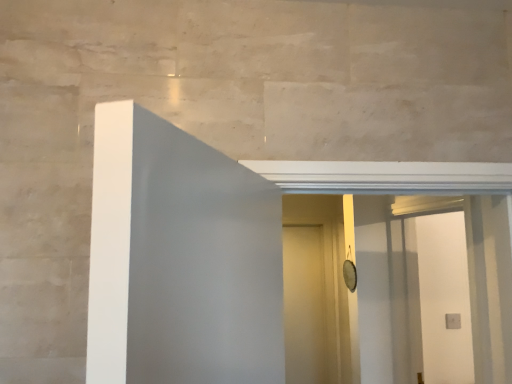
Question: Is white matte door at center completely or partially inside white glossy screen door at center?

Choices:
 (A) yes
 (B) no

Answer: (B)

Question: Is the surface of white glossy screen door at center in direct contact with white matte door at center?

Choices:
 (A) yes
 (B) no

Answer: (B)

Question: Considering the relative sizes of white glossy screen door at center and white matte door at center in the image provided, is white glossy screen door at center taller than white matte door at center?

Choices:
 (A) yes
 (B) no

Answer: (B)

Question: Is white glossy screen door at center positioned in front of white matte door at center?

Choices:
 (A) no
 (B) yes

Answer: (B)

Question: Is white glossy screen door at center looking in the opposite direction of white matte door at center?

Choices:
 (A) yes
 (B) no

Answer: (B)

Question: Could you tell me if white glossy screen door at center is facing white matte door at center?

Choices:
 (A) yes
 (B) no

Answer: (B)

Question: Is white matte door at center facing towards white glossy screen door at center?

Choices:
 (A) no
 (B) yes

Answer: (B)

Question: Is white matte door at center shorter than white glossy screen door at center?

Choices:
 (A) no
 (B) yes

Answer: (A)

Question: Considering the relative sizes of white matte door at center and white glossy screen door at center in the image provided, is white matte door at center smaller than white glossy screen door at center?

Choices:
 (A) no
 (B) yes

Answer: (B)

Question: Is white matte door at center outside of white glossy screen door at center?

Choices:
 (A) no
 (B) yes

Answer: (B)

Question: From a real-world perspective, does white matte door at center stand above white glossy screen door at center?

Choices:
 (A) yes
 (B) no

Answer: (B)

Question: Is white matte door at center far from white glossy screen door at center?

Choices:
 (A) no
 (B) yes

Answer: (B)

Question: Choose the correct answer: Is white matte door at center inside white glossy screen door at center or outside it?

Choices:
 (A) outside
 (B) inside

Answer: (A)